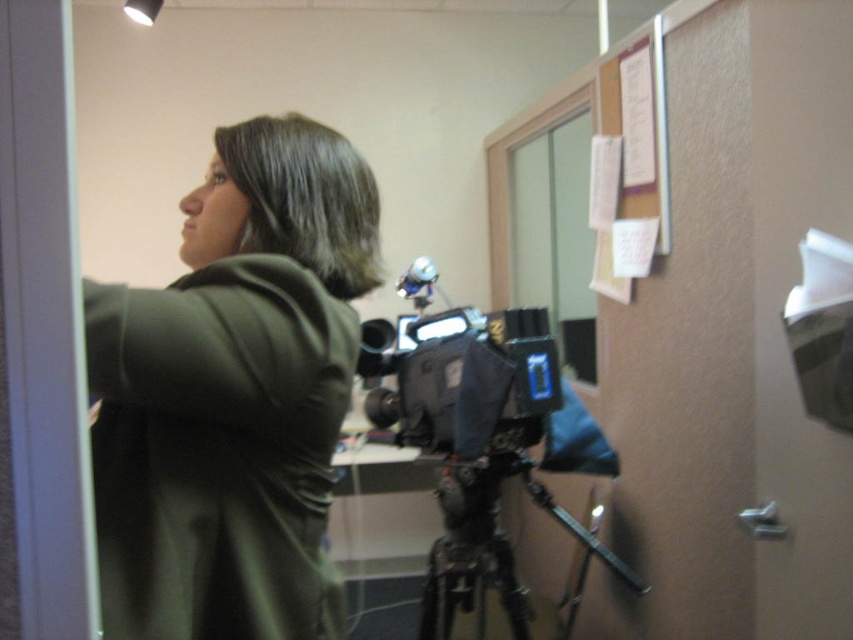
Question: Is black matte video camera at center to the left of black fabric camera at center from the viewer's perspective?

Choices:
 (A) no
 (B) yes

Answer: (A)

Question: Which object is closer to the camera taking this photo?

Choices:
 (A) black fabric camera at center
 (B) black matte video camera at center

Answer: (A)

Question: Which of these objects is positioned farthest from the black matte video camera at center?

Choices:
 (A) green matte jacket at upper left
 (B) black fabric camera at center
 (C) black matte tripod at center

Answer: (A)

Question: Which point is farther to the camera?

Choices:
 (A) green matte jacket at upper left
 (B) black matte tripod at center
 (C) black fabric camera at center

Answer: (B)

Question: Can you confirm if green matte jacket at upper left is positioned below black matte tripod at center?

Choices:
 (A) no
 (B) yes

Answer: (A)

Question: Can you confirm if black fabric camera at center is smaller than black matte tripod at center?

Choices:
 (A) yes
 (B) no

Answer: (A)